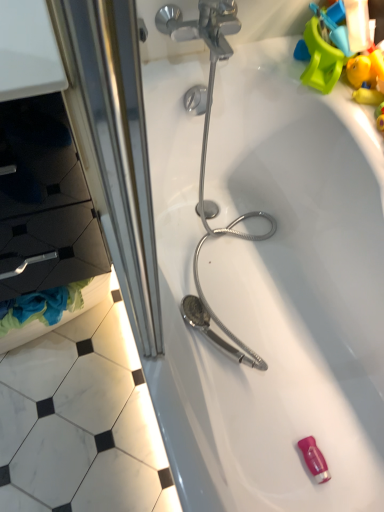
Question: Considering the relative positions of white glossy bathtub at center and black matte drawer at left in the image provided, is white glossy bathtub at center to the left or to the right of black matte drawer at left?

Choices:
 (A) left
 (B) right

Answer: (B)

Question: Considering their positions, is white glossy bathtub at center located in front of or behind black matte drawer at left?

Choices:
 (A) behind
 (B) front

Answer: (A)

Question: From their relative heights in the image, would you say white glossy bathtub at center is taller or shorter than black matte drawer at left?

Choices:
 (A) tall
 (B) short

Answer: (A)

Question: From a real-world perspective, is black matte drawer at left above or below white glossy bathtub at center?

Choices:
 (A) above
 (B) below

Answer: (A)

Question: From the image's perspective, is black matte drawer at left positioned above or below white glossy bathtub at center?

Choices:
 (A) below
 (B) above

Answer: (B)

Question: In terms of size, does black matte drawer at left appear bigger or smaller than white glossy bathtub at center?

Choices:
 (A) big
 (B) small

Answer: (B)

Question: Based on their positions, is black matte drawer at left located to the left or right of white glossy bathtub at center?

Choices:
 (A) right
 (B) left

Answer: (B)